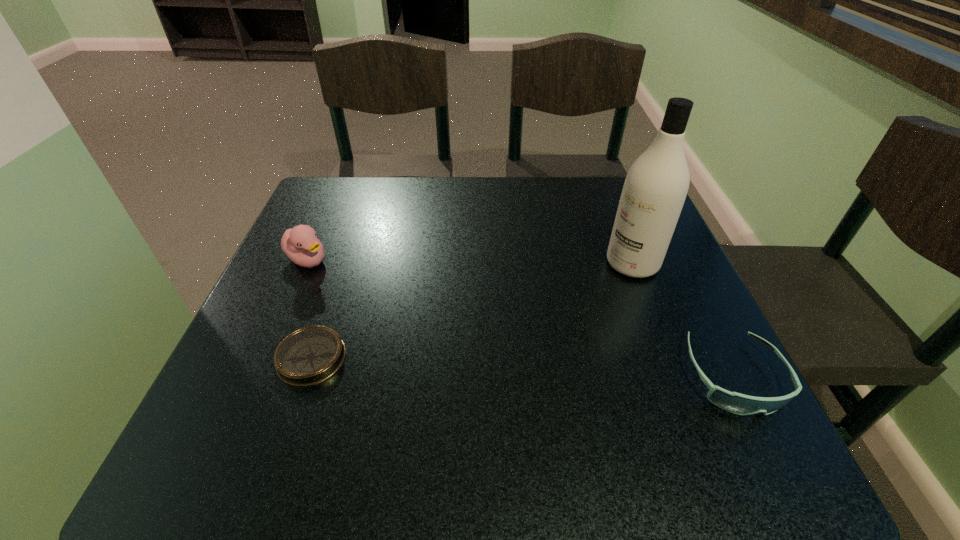
Where is `unoccupied area between the third shortest object and the compass`? This screenshot has height=540, width=960. unoccupied area between the third shortest object and the compass is located at coordinates (310, 309).

I want to click on vacant area that lies between the third tallest object and the tallest object, so click(684, 320).

I want to click on blank region between the second shortest object and the third shortest object, so click(520, 318).

Locate an element on the screen. Image resolution: width=960 pixels, height=540 pixels. empty location between the shampoo and the goggles is located at coordinates (684, 320).

This screenshot has width=960, height=540. I want to click on vacant area that lies between the duckling and the compass, so click(x=310, y=309).

Select which object is the third closest to the compass. Please provide its 2D coordinates. Your answer should be formatted as a tuple, i.e. [(x, y)], where the tuple contains the x and y coordinates of a point satisfying the conditions above.

[(737, 403)]

Identify the location of object that is the third closest to the goggles. The height and width of the screenshot is (540, 960). (300, 244).

Locate an element on the screen. free location that satisfies the following two spatial constraints: 1. on the back side of the shampoo; 2. on the left side of the compass is located at coordinates (344, 264).